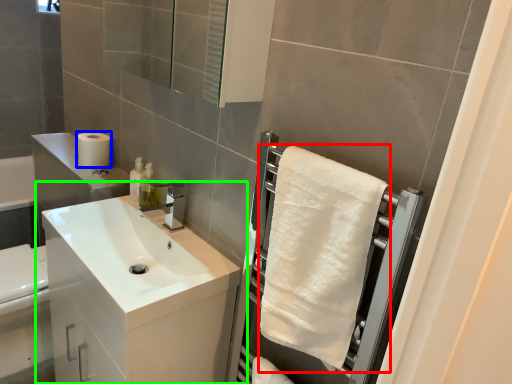
Question: Which object is the farthest from bath towel (highlighted by a red box)? Choose among these: toilet paper (highlighted by a blue box) or bathroom cabinet (highlighted by a green box).

Choices:
 (A) toilet paper
 (B) bathroom cabinet

Answer: (A)